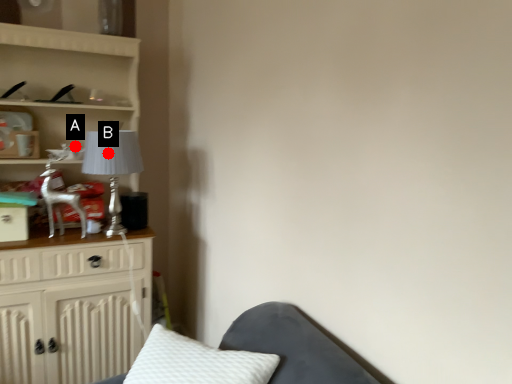
Question: Two points are circled on the image, labeled by A and B beside each circle. Which point is closer to the camera taking this photo?

Choices:
 (A) A is closer
 (B) B is closer

Answer: (B)